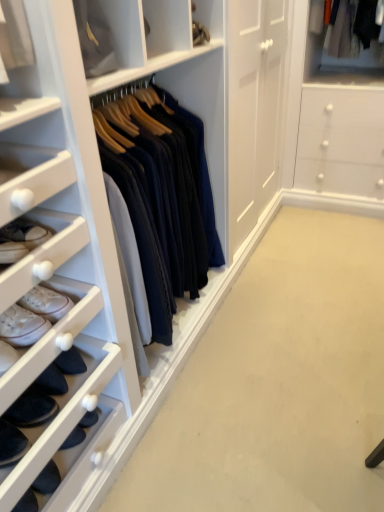
Question: In terms of size, does matte white cabinet at upper center appear bigger or smaller than dark blue suede shoe at lower left, which is counted as the 2th footwear, starting from the top?

Choices:
 (A) small
 (B) big

Answer: (B)

Question: Considering their positions, is matte white cabinet at upper center located in front of or behind dark blue suede shoe at lower left, which is counted as the 2th footwear, starting from the top?

Choices:
 (A) front
 (B) behind

Answer: (B)

Question: Considering the real-world distances, which object is closest to the matte white cabinet at upper center?

Choices:
 (A) white leather sneakers at lower left, arranged as the second footwear when ordered from the bottom
 (B) dark blue suede shoe at lower left, which is counted as the 2th footwear, starting from the top

Answer: (A)

Question: Which of these objects is positioned closest to the white leather sneakers at lower left, arranged as the second footwear when ordered from the bottom?

Choices:
 (A) dark blue suede shoe at lower left, placed as the 1th footwear when sorted from bottom to top
 (B) matte white cabinet at upper center

Answer: (A)